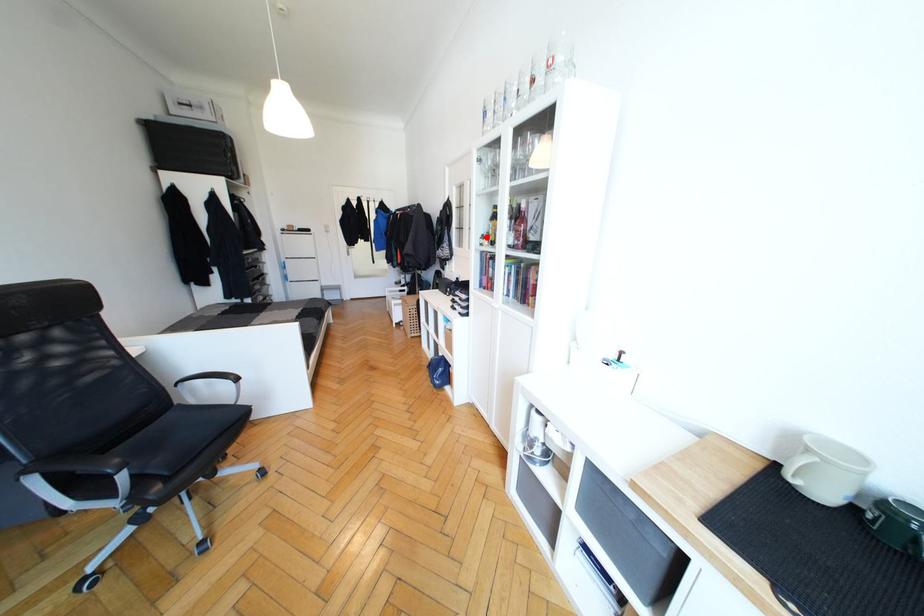
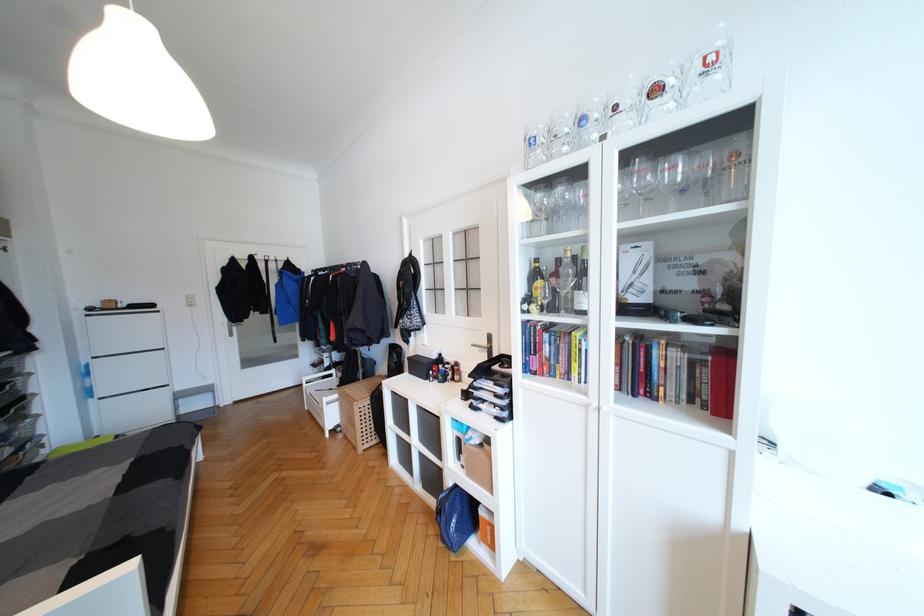
Find the pixel in the second image that matches the highlighted location in the first image.

(531, 301)